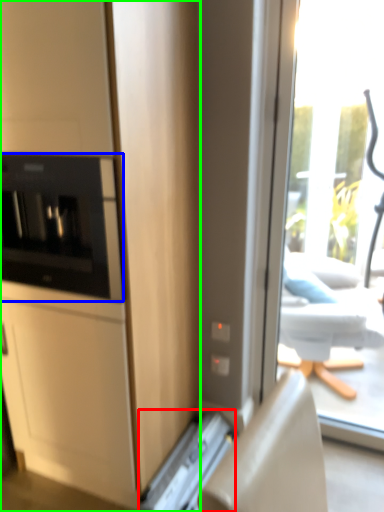
Question: Based on their relative distances, which object is farther from appliance (highlighted by a red box)? Choose from home appliance (highlighted by a blue box) and cabinetry (highlighted by a green box).

Choices:
 (A) home appliance
 (B) cabinetry

Answer: (A)